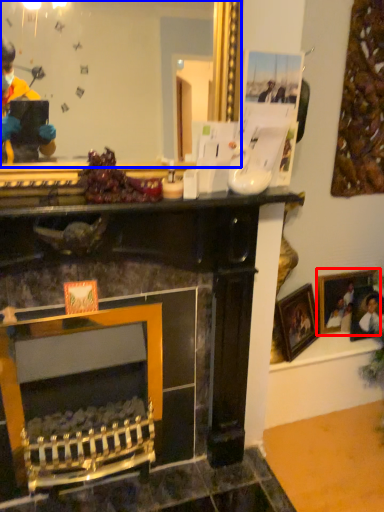
Question: Among these objects, which one is farthest to the camera, picture frame (highlighted by a red box) or mirror (highlighted by a blue box)?

Choices:
 (A) picture frame
 (B) mirror

Answer: (A)